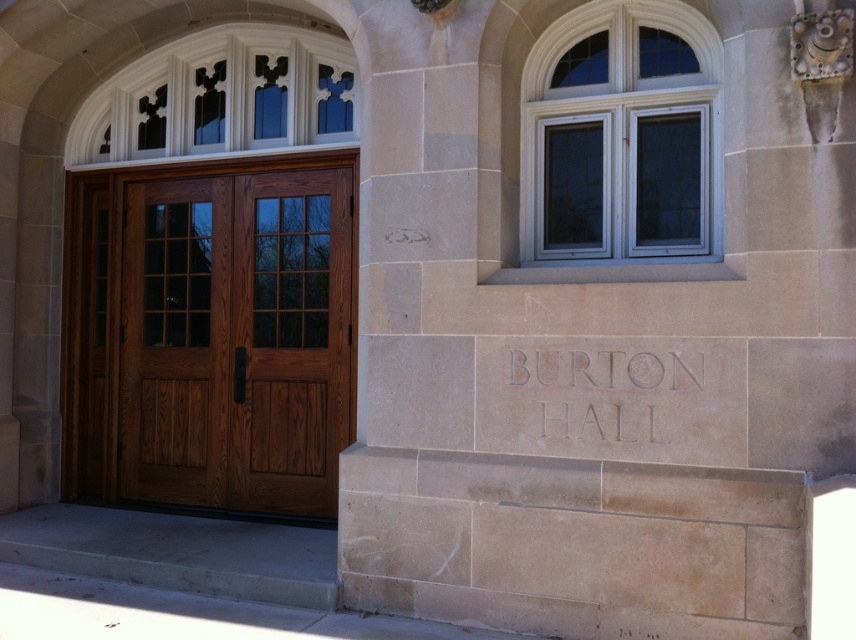
You are standing at the entrance of Burton Hall and want to determine the relative positions of two points marked on the building. Which point is closer to your eyes when looking at the entrance? The points are labeled as point (x=381, y=333) and point (x=660, y=364).

Point (x=381, y=333) is further to the camera than point (x=660, y=364), so the point closer to your eyes is point (x=660, y=364).

You are standing at the entrance of Burton Hall and want to open the mahogany wood door at center. To do so, you need to move aside the beige stone pillar at center first. Is this possible? Explain why or why not based on their positions.

The beige stone pillar at center is to the right of the mahogany wood door at center, so you cannot move the pillar to open the door because the pillar is positioned next to the door and likely part of the building structure, making it immovable.